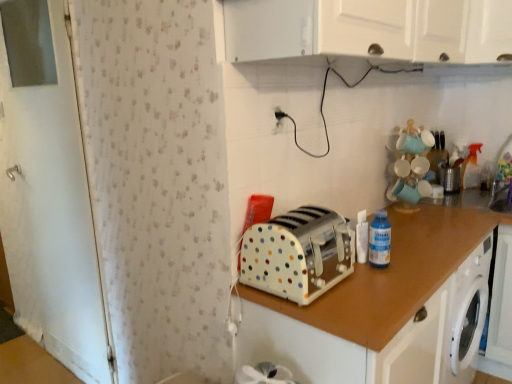
Question: Is metallic silver toaster at upper right taller or shorter than blue plastic bottle at upper right?

Choices:
 (A) tall
 (B) short

Answer: (B)

Question: From the image's perspective, is metallic silver toaster at upper right located above or below blue plastic bottle at upper right?

Choices:
 (A) above
 (B) below

Answer: (A)

Question: Which of these objects is positioned closest to the matte white cups at upper right?

Choices:
 (A) white glossy cabinet at upper center, which ranks as the first cabinetry in top-to-bottom order
 (B) blue plastic bottle at upper right
 (C) white plastic electric outlet at upper center
 (D) white polka dot toaster at center, which is the second cabinetry from top to bottom
 (E) transparent plastic sink at lower right

Answer: (E)

Question: Which is nearer to the white polka dot plastic toaster at center?

Choices:
 (A) white glossy cabinet at upper center, marked as the 2th cabinetry in a bottom-to-top arrangement
 (B) matte white cups at upper right
 (C) white polka dot toaster at center, which appears as the first cabinetry when ordered from the bottom
 (D) blue plastic bottle at upper right
 (E) white plastic electric outlet at upper center

Answer: (C)